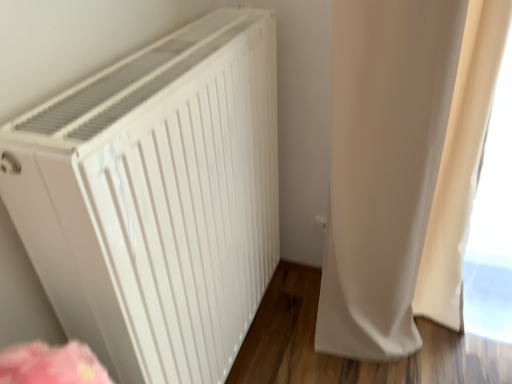
Describe the element at coordinates (404, 166) in the screenshot. I see `beige fabric curtain at right` at that location.

I want to click on beige fabric curtain at right, so point(404,166).

What is the approximate height of white matte radiator at left?

37.68 inches.

In order to face white matte radiator at left, should I rotate leftwards or rightwards?

Rotate your view left by about 6.446°.

What do you see at coordinates (157, 199) in the screenshot? I see `white matte radiator at left` at bounding box center [157, 199].

I want to click on white matte radiator at left, so click(x=157, y=199).

This screenshot has height=384, width=512. I want to click on beige fabric curtain at right, so click(404, 166).

Which is more to the right, beige fabric curtain at right or white matte radiator at left?

Positioned to the right is beige fabric curtain at right.

Is beige fabric curtain at right positioned behind white matte radiator at left?

Yes, beige fabric curtain at right is further from the viewer.

Considering the points (377, 22) and (170, 143), which point is in front, point (377, 22) or point (170, 143)?

The point (170, 143) is in front.

From the image's perspective, which is above, beige fabric curtain at right or white matte radiator at left?

beige fabric curtain at right, from the image's perspective.

In the scene shown: From a real-world perspective, is beige fabric curtain at right physically located above or below white matte radiator at left?

In terms of real-world spatial position, beige fabric curtain at right is below white matte radiator at left.

Can you confirm if beige fabric curtain at right is wider than white matte radiator at left?

Correct, the width of beige fabric curtain at right exceeds that of white matte radiator at left.

Does beige fabric curtain at right have a lesser height compared to white matte radiator at left?

In fact, beige fabric curtain at right may be taller than white matte radiator at left.

Considering the sizes of objects beige fabric curtain at right and white matte radiator at left in the image provided, who is bigger, beige fabric curtain at right or white matte radiator at left?

Result: With larger size is white matte radiator at left.

Could white matte radiator at left be considered to be inside beige fabric curtain at right?

No, white matte radiator at left is not a part of beige fabric curtain at right.

Is the surface of beige fabric curtain at right in direct contact with white matte radiator at left?

No, beige fabric curtain at right is not beside white matte radiator at left.

Is beige fabric curtain at right facing away from white matte radiator at left?

beige fabric curtain at right is not turned away from white matte radiator at left.

Locate an element on the screen. The width and height of the screenshot is (512, 384). home appliance below the beige fabric curtain at right (from the image's perspective) is located at coordinates (157, 199).

Can you confirm if white matte radiator at left is positioned to the right of beige fabric curtain at right?

No, white matte radiator at left is not to the right of beige fabric curtain at right.

Which is in front, white matte radiator at left or beige fabric curtain at right?

white matte radiator at left is closer to the camera.

Does point (215, 77) come farther from viewer compared to point (360, 87)?

No, (215, 77) is in front of (360, 87).

From the image's perspective, is white matte radiator at left below beige fabric curtain at right?

Yes, from the image's perspective, white matte radiator at left is below beige fabric curtain at right.

From a real-world perspective, between white matte radiator at left and beige fabric curtain at right, who is vertically higher?

In real-world perspective, white matte radiator at left is above.

Which of these two, white matte radiator at left or beige fabric curtain at right, is thinner?

white matte radiator at left is thinner.

Considering the relative sizes of white matte radiator at left and beige fabric curtain at right in the image provided, is white matte radiator at left taller than beige fabric curtain at right?

In fact, white matte radiator at left may be shorter than beige fabric curtain at right.

Based on their sizes in the image, would you say white matte radiator at left is bigger or smaller than beige fabric curtain at right?

Considering their sizes, white matte radiator at left takes up more space than beige fabric curtain at right.

Choose the correct answer: Is white matte radiator at left inside beige fabric curtain at right or outside it?

white matte radiator at left is located beyond the bounds of beige fabric curtain at right.

Is the surface of white matte radiator at left in direct contact with beige fabric curtain at right?

No, white matte radiator at left is not touching beige fabric curtain at right.

Is white matte radiator at left oriented towards beige fabric curtain at right?

Yes, white matte radiator at left faces towards beige fabric curtain at right.

In the scene shown: Measure the distance from white matte radiator at left to beige fabric curtain at right.

A distance of 17.96 inches exists between white matte radiator at left and beige fabric curtain at right.

I want to click on home appliance below the beige fabric curtain at right (from the image's perspective), so click(x=157, y=199).

I want to click on home appliance in front of the beige fabric curtain at right, so click(157, 199).

Image resolution: width=512 pixels, height=384 pixels. What are the coordinates of `home appliance that is above the beige fabric curtain at right (from a real-world perspective)` in the screenshot? It's located at (157, 199).